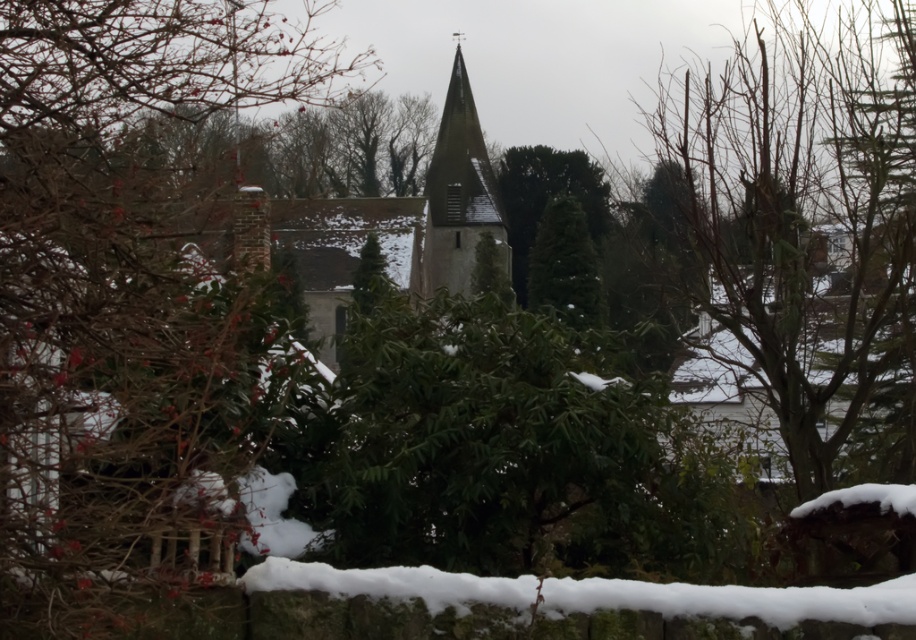
In the scene shown: Between green leafy bush at center and gray stone tower at center, which one appears on the left side from the viewer's perspective?

green leafy bush at center

Is green leafy bush at center smaller than gray stone tower at center?

Yes, green leafy bush at center is smaller than gray stone tower at center.

What are the coordinates of `green leafy bush at center` in the screenshot? It's located at (115, 288).

This screenshot has width=916, height=640. I want to click on green leafy bush at center, so click(115, 288).